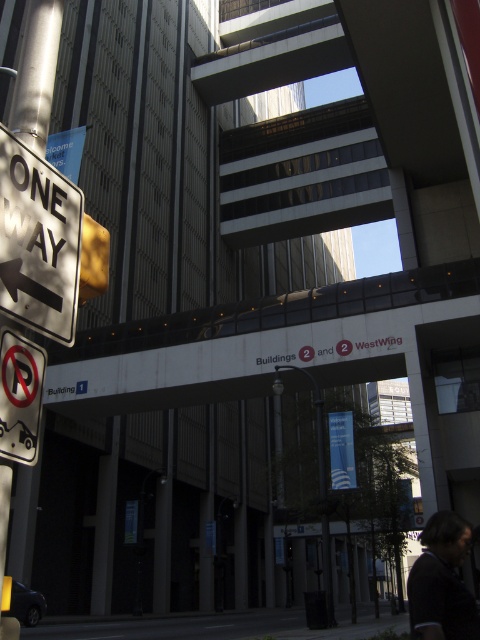
Is white concrete overpass at center smaller than white plastic one-way sign at left?

Incorrect, white concrete overpass at center is not smaller in size than white plastic one-way sign at left.

Describe the element at coordinates (256, 342) in the screenshot. I see `white concrete overpass at center` at that location.

Is point (86, 392) farther from viewer compared to point (45, 323)?

Yes.

Locate an element on the screen. Image resolution: width=480 pixels, height=640 pixels. white concrete overpass at center is located at coordinates (256, 342).

How far apart are white plastic one-way sign at left and white plastic no-parking sign at lower left?

A distance of 30.27 centimeters exists between white plastic one-way sign at left and white plastic no-parking sign at lower left.

Locate an element on the screen. This screenshot has width=480, height=640. white plastic one-way sign at left is located at coordinates pos(37,241).

Who is higher up, white concrete overpass at center or white plastic no-parking sign at lower left?

Positioned higher is white plastic no-parking sign at lower left.

Image resolution: width=480 pixels, height=640 pixels. What are the coordinates of `white concrete overpass at center` in the screenshot? It's located at (256, 342).